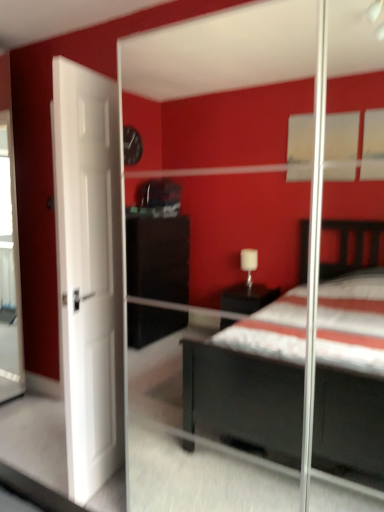
Identify the location of free point to the left of white matte door at left. (44, 460).